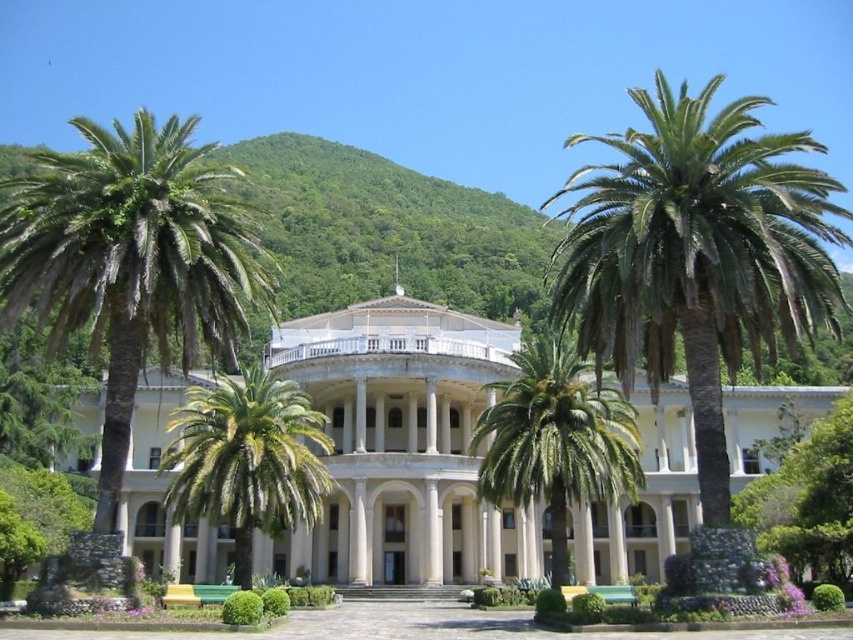
Question: Is the position of green leafy palm at right less distant than that of green leafy palm at left?

Choices:
 (A) no
 (B) yes

Answer: (B)

Question: Is green leafy palm at right to the left of green leafy palm at left from the viewer's perspective?

Choices:
 (A) yes
 (B) no

Answer: (B)

Question: Observing the image, what is the correct spatial positioning of green leafy palm at right in reference to green leafy palm at left?

Choices:
 (A) left
 (B) right

Answer: (B)

Question: Based on their relative distances, which object is nearer to the green leafy palm at right?

Choices:
 (A) green leafy palm at left
 (B) green leafy palm at center

Answer: (B)

Question: Which object appears farthest from the camera in this image?

Choices:
 (A) green leafy palm at right
 (B) green leafy palm tree at center
 (C) green leafy palm at left

Answer: (B)

Question: Which of the following is the farthest from the observer?

Choices:
 (A) (239, 577)
 (B) (648, 141)
 (C) (144, 120)
 (D) (543, 419)

Answer: (A)